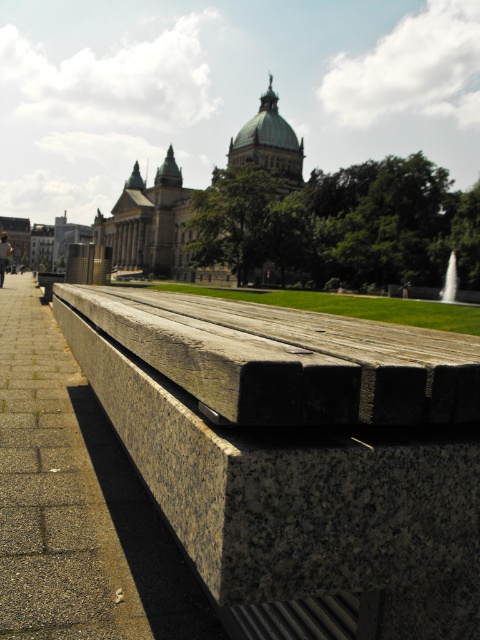
You are standing at the entrance of the park and want to locate the white marble fountain at center. According to the coordinates provided, where should you look relative to your current position?

The white marble fountain at center is located at coordinates point 0.439 on the x axis and 0.938 on the y axis, so you should look towards the right side and slightly upwards from your current position.

You are planning to place a new flower pot that is 1 meter in height between the granite bench at lower center and the white marble fountain at center. Considering their sizes, which object should the flower pot be placed closer to?

The granite bench at lower center is bigger than the white marble fountain at center. Therefore, the flower pot should be placed closer to the white marble fountain at center to maintain balance in the arrangement.